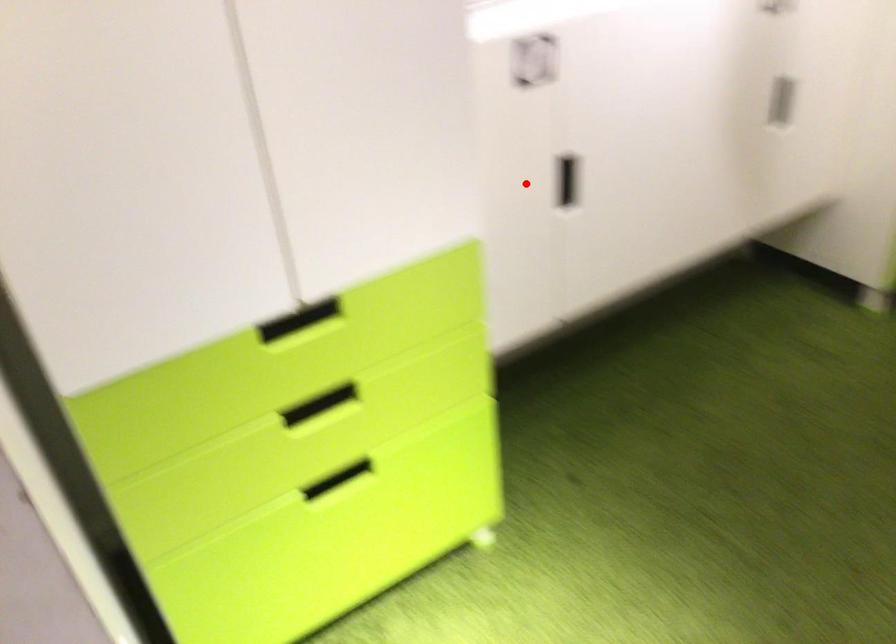
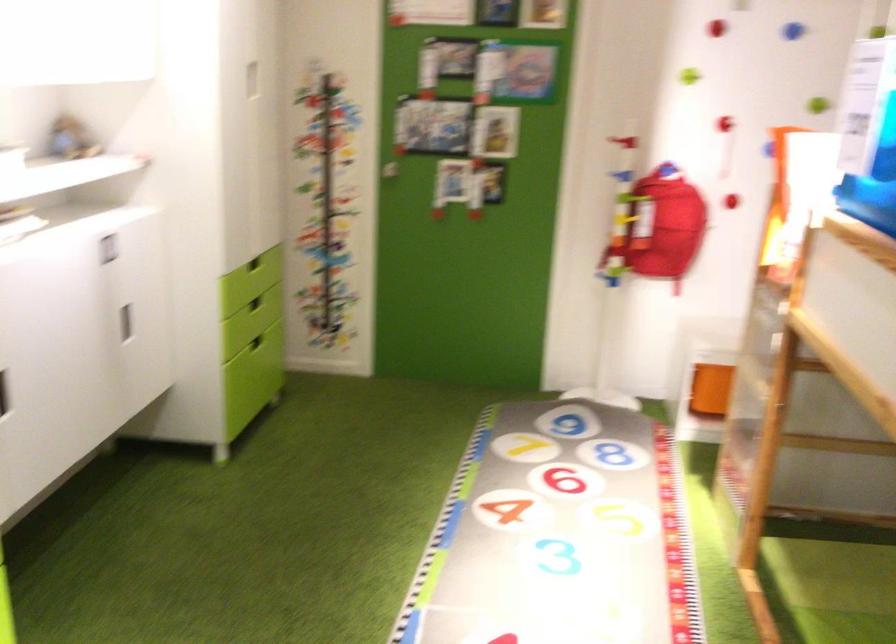
Locate, in the second image, the point that corresponds to the highlighted location in the first image.

(3, 393)